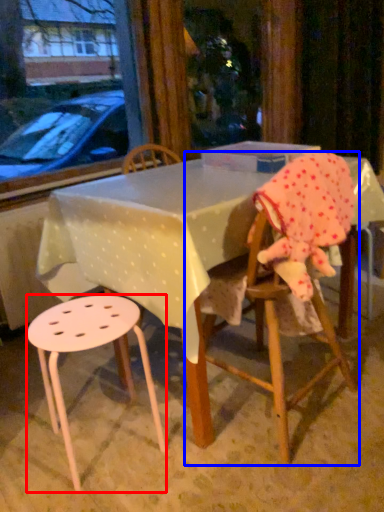
Question: Which of the following is the farthest to the observer, stool (highlighted by a red box) or chair (highlighted by a blue box)?

Choices:
 (A) stool
 (B) chair

Answer: (A)